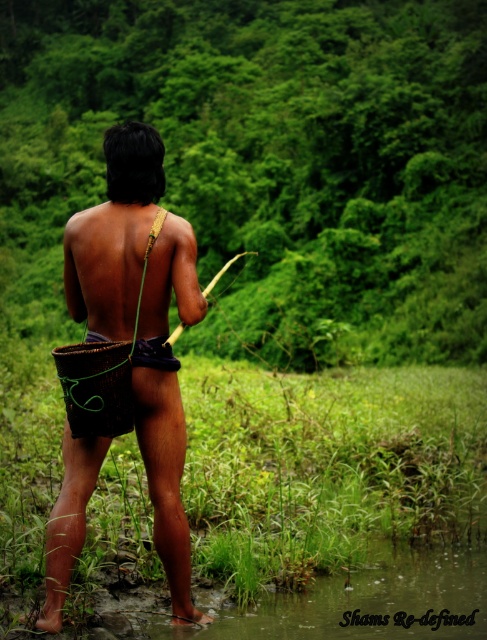
Question: Does green leafy vegetation at center come behind brown woven basket at center?

Choices:
 (A) no
 (B) yes

Answer: (B)

Question: Observing the image, what is the correct spatial positioning of green leafy vegetation at center in reference to brown woven basket at center?

Choices:
 (A) above
 (B) below

Answer: (A)

Question: Which point is closer to the camera?

Choices:
 (A) brown woven basket at center
 (B) green leafy vegetation at center

Answer: (A)

Question: Among these points, which one is nearest to the camera?

Choices:
 (A) (32, 301)
 (B) (138, 262)

Answer: (B)

Question: Which of the following is the closest to the observer?

Choices:
 (A) (106, 252)
 (B) (472, 202)

Answer: (A)

Question: Is green leafy vegetation at center bigger than brown woven basket at center?

Choices:
 (A) yes
 (B) no

Answer: (A)